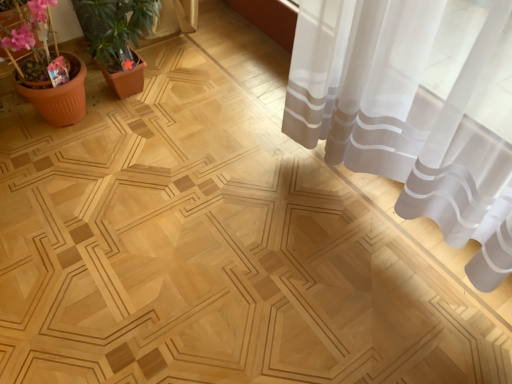
Describe the element at coordinates (46, 69) in the screenshot. This screenshot has width=512, height=384. I see `matte terracotta pot at left` at that location.

Locate an element on the screen. Image resolution: width=512 pixels, height=384 pixels. matte terracotta pot at left is located at coordinates click(x=46, y=69).

I want to click on matte terracotta pot at left, so click(46, 69).